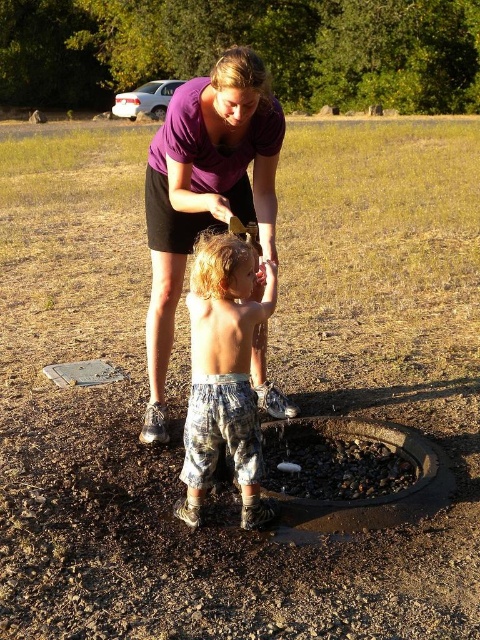
Who is positioned more to the left, purple cotton shirt at upper center or rusty metal manhole at center?

purple cotton shirt at upper center

Does point (158, 392) come in front of point (368, 500)?

No.

Which is behind, point (240, 182) or point (358, 445)?

The point (358, 445) is behind.

Locate an element on the screen. This screenshot has width=480, height=640. purple cotton shirt at upper center is located at coordinates (204, 189).

Between purple cotton shirt at upper center and metallic gray hole at lower center, which one appears on the left side from the viewer's perspective?

metallic gray hole at lower center

Looking at this image, is purple cotton shirt at upper center further to the viewer compared to metallic gray hole at lower center?

No, purple cotton shirt at upper center is in front of metallic gray hole at lower center.

Between point (189, 81) and point (75, 381), which one is positioned behind?

The point (75, 381) is behind.

In order to click on purple cotton shirt at upper center in this screenshot , I will do tap(204, 189).

Can you confirm if purple cotton shirt at upper center is positioned to the right of camouflage pants at center?

Incorrect, purple cotton shirt at upper center is not on the right side of camouflage pants at center.

You are a GUI agent. You are given a task and a screenshot of the screen. Output one action in this format:
    pyautogui.click(x=<x>, y=<y>)
    Task: Click on the purple cotton shirt at upper center
    
    Given the screenshot: What is the action you would take?
    pos(204,189)

This screenshot has width=480, height=640. Identify the location of purple cotton shirt at upper center. (204, 189).